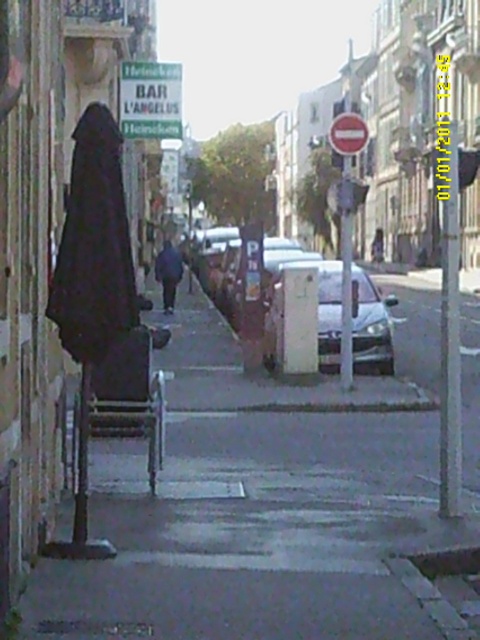
Question: Is dark gray concrete sidewalk at left closer to the viewer compared to black matte coat at left?

Choices:
 (A) yes
 (B) no

Answer: (A)

Question: Is dark gray concrete sidewalk at left above dark gray coat at center?

Choices:
 (A) yes
 (B) no

Answer: (B)

Question: Considering the relative positions of black matte coat at left and dark gray coat at center in the image provided, where is black matte coat at left located with respect to dark gray coat at center?

Choices:
 (A) above
 (B) below

Answer: (B)

Question: Which point appears farthest from the camera in this image?

Choices:
 (A) [354, 308]
 (B) [276, 349]
 (C) [121, 108]
 (D) [226, 448]

Answer: (C)

Question: Considering the real-world distances, which object is farthest from the black matte coat at left?

Choices:
 (A) dark gray coat at center
 (B) white matte car at center
 (C) dark gray concrete sidewalk at left
 (D) white glossy car at center

Answer: (A)

Question: Which of these objects is positioned closest to the dark gray coat at center?

Choices:
 (A) black matte coat at left
 (B) white matte car at center
 (C) dark gray concrete sidewalk at left

Answer: (B)